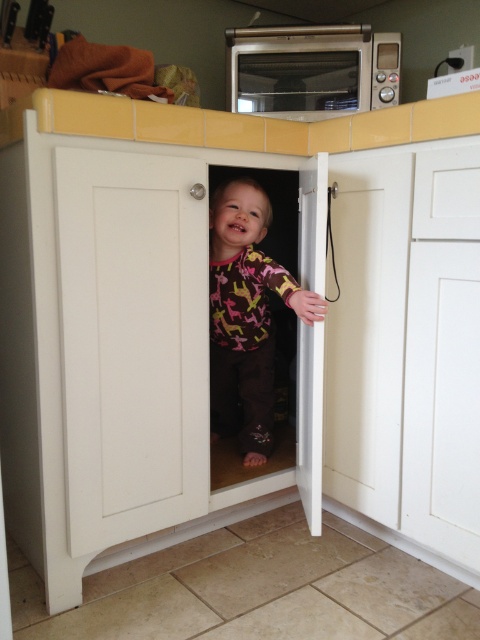
You are a parent looking for your baby. You see the white matte cabinet door at center and the multicolored fabric baby at center. Which object is on the right side?

The multicolored fabric baby at center is on the right side because the white matte cabinet door at center is to the left of it.

You are a parent looking for your child in the kitchen. According to the image, where is the multicolored fabric baby at center relative to the satin silver microwave at upper center?

The multicolored fabric baby at center is located below the satin silver microwave at upper center.